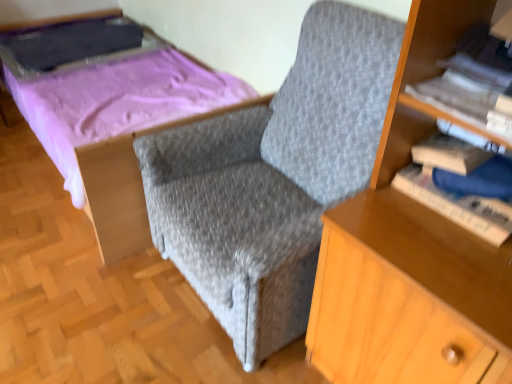
Question: In terms of size, does matte purple bed at upper left appear bigger or smaller than white paper book at upper right, placed as the 2th book when sorted from bottom to top?

Choices:
 (A) small
 (B) big

Answer: (B)

Question: Would you say matte purple bed at upper left is to the left or to the right of white paper book at upper right, placed as the 2th book when sorted from bottom to top, in the picture?

Choices:
 (A) right
 (B) left

Answer: (B)

Question: Estimate the real-world distances between objects in this image. Which object is closer to the hardcover book at right, which ranks as the first book in bottom-to-top order?

Choices:
 (A) gray fabric armchair at center
 (B) matte purple bed at upper left
 (C) white paper book at upper right, placed as the 2th book when sorted from bottom to top

Answer: (C)

Question: Based on their relative distances, which object is nearer to the white paper book at upper right, the first book when ordered from top to bottom?

Choices:
 (A) hardcover book at right, which ranks as the first book in bottom-to-top order
 (B) matte purple bed at upper left
 (C) gray fabric armchair at center

Answer: (A)